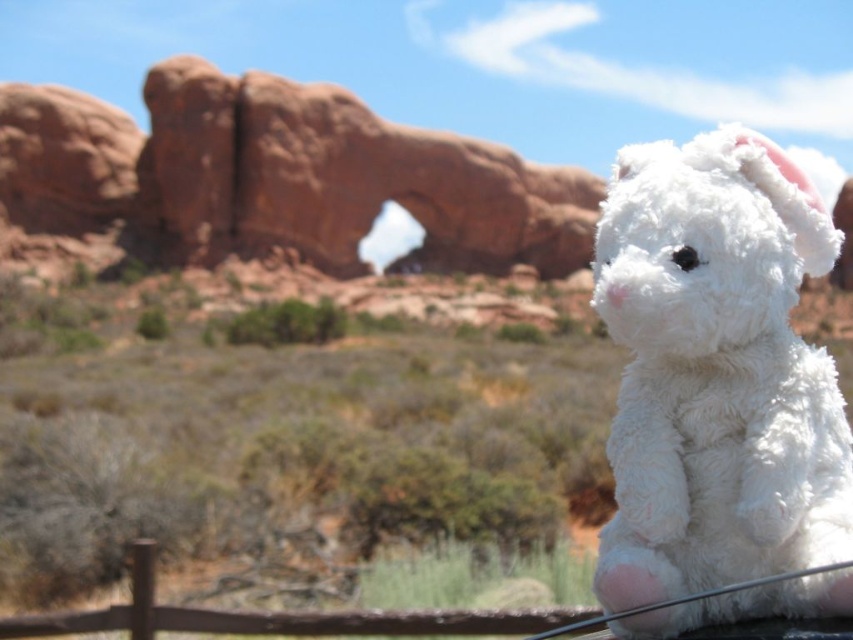
You are standing in front of the plush toy resembling a white dog with pink inner ears and a small black nose. You want to place a small flag exactly 20 meters away from where you are standing. According to the image, can you place the flag at the point marked as point (714, 531)?

The point marked as point (714, 531) is 17.93 meters from the viewer, which is less than 20 meters. Therefore, placing the flag there would not meet the requirement of being 20 meters away.

You are a photographer setting up a shot of the white fluffy stuffed animal at right and the rustic sandstone arch at center. To ensure the stuffed animal is in front of the arch, should you place it closer to the camera or further away?

The white fluffy stuffed animal at right is positioned under rustic sandstone arch at center, so to have it in front of the arch, you should place it closer to the camera so it appears in front.

You are an artist planning to paint the scene with the rustic sandstone arch at center and the brown wooden fence at lower center. You want to ensure the arch looks wider than the fence in your painting. Does the current arrangement allow this?

Yes, the rustic sandstone arch at center is wider than the brown wooden fence at lower center, so the current arrangement allows the arch to appear wider in the painting.